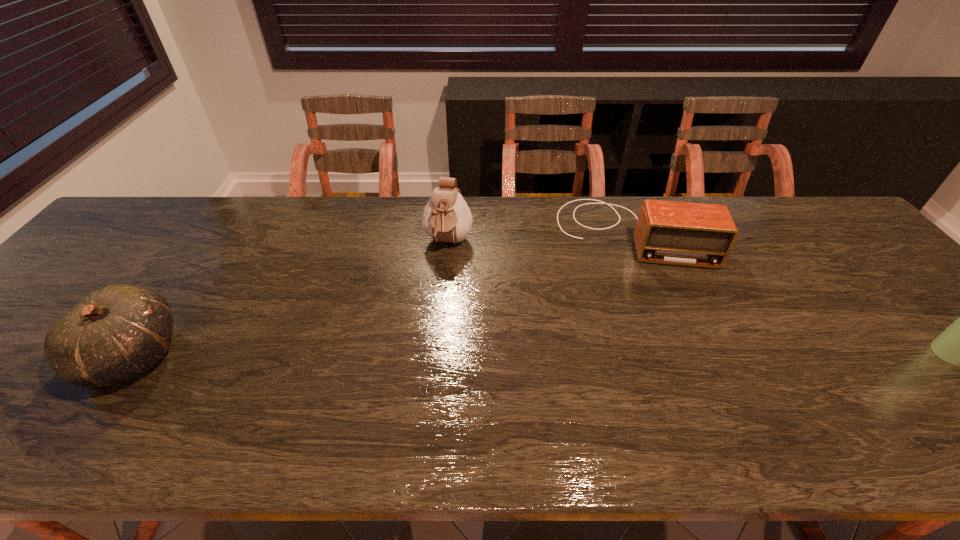
What are the coordinates of `free space between the leftmost object and the pouch` in the screenshot? It's located at (291, 299).

Where is `free space between the third object from right to left and the leftmost object`? free space between the third object from right to left and the leftmost object is located at coordinates (291, 299).

Locate an element on the screen. vacant space in between the radio receiver and the third object from right to left is located at coordinates (540, 237).

This screenshot has width=960, height=540. I want to click on vacant area that lies between the gourd and the pouch, so pos(291,299).

Identify which object is the nearest to the leftmost object. Please provide its 2D coordinates. Your answer should be formatted as a tuple, i.e. [(x, y)], where the tuple contains the x and y coordinates of a point satisfying the conditions above.

[(446, 218)]

The height and width of the screenshot is (540, 960). What are the coordinates of `the closest object to the thermos bottle` in the screenshot? It's located at (667, 232).

This screenshot has height=540, width=960. Find the location of `blank area in the image that satisfies the following two spatial constraints: 1. on the back side of the pouch; 2. on the left side of the shortest object`. blank area in the image that satisfies the following two spatial constraints: 1. on the back side of the pouch; 2. on the left side of the shortest object is located at coordinates (448, 232).

You are a GUI agent. You are given a task and a screenshot of the screen. Output one action in this format:
    pyautogui.click(x=<x>, y=<y>)
    Task: Click on the free location that satisfies the following two spatial constraints: 1. on the back side of the gourd; 2. on the left side of the second object from left to right
    This screenshot has width=960, height=540.
    Given the screenshot: What is the action you would take?
    pyautogui.click(x=211, y=242)